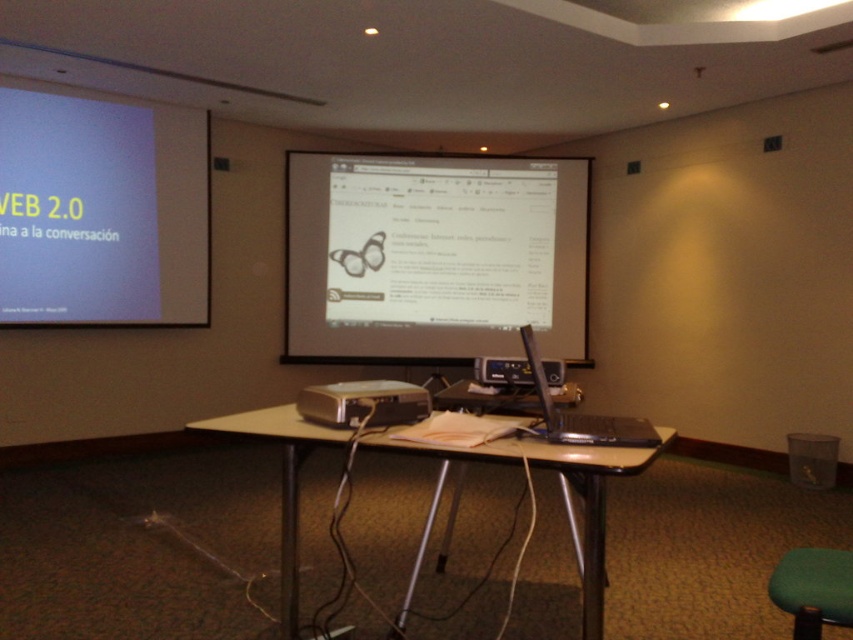
Which is in front, point (32, 276) or point (821, 572)?

Point (821, 572) is in front.

Is point (143, 314) less distant than point (839, 564)?

No, it is not.

Which is in front, point (160, 176) or point (814, 600)?

Point (814, 600) is more forward.

You are a GUI agent. You are given a task and a screenshot of the screen. Output one action in this format:
    pyautogui.click(x=<x>, y=<y>)
    Task: Click on the white matte projection screen at upper left
    The width and height of the screenshot is (853, 640).
    Given the screenshot: What is the action you would take?
    pyautogui.click(x=102, y=211)

Does white matte projection screen at upper left appear on the left side of metallic silver table at center?

Indeed, white matte projection screen at upper left is positioned on the left side of metallic silver table at center.

Is white matte projection screen at upper left positioned in front of metallic silver table at center?

No.

Between point (48, 232) and point (297, 566), which one is positioned behind?

Point (48, 232)

The height and width of the screenshot is (640, 853). Find the location of `white matte projection screen at upper left`. white matte projection screen at upper left is located at coordinates (102, 211).

Based on the photo, can you confirm if white matte projection screen at upper left is bigger than black plastic projector at center?

Indeed, white matte projection screen at upper left has a larger size compared to black plastic projector at center.

How far apart are white matte projection screen at upper left and black plastic projector at center?

white matte projection screen at upper left and black plastic projector at center are 10.86 feet apart from each other.

Where is `white matte projection screen at upper left`? white matte projection screen at upper left is located at coordinates (102, 211).

Where is `white matte projection screen at upper left`? Image resolution: width=853 pixels, height=640 pixels. white matte projection screen at upper left is located at coordinates (102, 211).